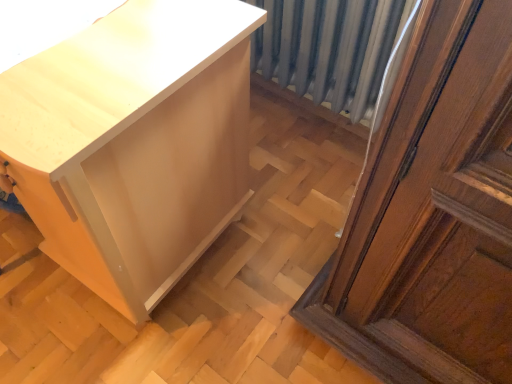
Where is `white glossy cabinet at lower left`? white glossy cabinet at lower left is located at coordinates (134, 143).

What is the approximate width of white glossy cabinet at lower left?

white glossy cabinet at lower left is 23.91 inches wide.

Describe the element at coordinates (134, 143) in the screenshot. I see `white glossy cabinet at lower left` at that location.

Where is `metallic gray radiator at center`? This screenshot has width=512, height=384. metallic gray radiator at center is located at coordinates (329, 49).

Describe the element at coordinates (329, 49) in the screenshot. I see `metallic gray radiator at center` at that location.

Where is `white glossy cabinet at lower left`? The image size is (512, 384). white glossy cabinet at lower left is located at coordinates (134, 143).

Between white glossy cabinet at lower left and metallic gray radiator at center, which one appears on the right side from the viewer's perspective?

From the viewer's perspective, metallic gray radiator at center appears more on the right side.

Is the depth of white glossy cabinet at lower left greater than that of metallic gray radiator at center?

No, white glossy cabinet at lower left is closer to the viewer.

Between point (187, 219) and point (303, 88), which one is positioned in front?

The point (187, 219) is in front.

From the image's perspective, does white glossy cabinet at lower left appear lower than metallic gray radiator at center?

Correct, white glossy cabinet at lower left appears lower than metallic gray radiator at center in the image.

From a real-world perspective, is white glossy cabinet at lower left below metallic gray radiator at center?

Correct, in the physical world, white glossy cabinet at lower left is lower than metallic gray radiator at center.

Can you confirm if white glossy cabinet at lower left is thinner than metallic gray radiator at center?

No.

Can you confirm if white glossy cabinet at lower left is taller than metallic gray radiator at center?

Yes.

Is white glossy cabinet at lower left smaller than metallic gray radiator at center?

No, white glossy cabinet at lower left is not smaller than metallic gray radiator at center.

Can metallic gray radiator at center be found inside white glossy cabinet at lower left?

No, metallic gray radiator at center is not inside white glossy cabinet at lower left.

Are white glossy cabinet at lower left and metallic gray radiator at center located far from each other?

No, white glossy cabinet at lower left is not far from metallic gray radiator at center.

Does white glossy cabinet at lower left turn towards metallic gray radiator at center?

No, white glossy cabinet at lower left is not aimed at metallic gray radiator at center.

In order to click on furniture below the metallic gray radiator at center (from the image's perspective) in this screenshot , I will do `click(134, 143)`.

Between metallic gray radiator at center and white glossy cabinet at lower left, which one appears on the left side from the viewer's perspective?

white glossy cabinet at lower left is more to the left.

From the picture: Relative to white glossy cabinet at lower left, is metallic gray radiator at center in front or behind?

Clearly, metallic gray radiator at center is behind white glossy cabinet at lower left.

Considering the positions of point (335, 16) and point (234, 73), is point (335, 16) closer or farther from the camera than point (234, 73)?

Point (335, 16) is farther from the camera than point (234, 73).

From the image's perspective, is metallic gray radiator at center on top of white glossy cabinet at lower left?

Yes, from the image's perspective, metallic gray radiator at center is over white glossy cabinet at lower left.

From a real-world perspective, is metallic gray radiator at center above or below white glossy cabinet at lower left?

metallic gray radiator at center is above white glossy cabinet at lower left.

Can you confirm if metallic gray radiator at center is wider than white glossy cabinet at lower left?

In fact, metallic gray radiator at center might be narrower than white glossy cabinet at lower left.

Does metallic gray radiator at center have a greater height compared to white glossy cabinet at lower left?

No.

Does metallic gray radiator at center have a larger size compared to white glossy cabinet at lower left?

Incorrect, metallic gray radiator at center is not larger than white glossy cabinet at lower left.

Would you say metallic gray radiator at center contains white glossy cabinet at lower left?

No, white glossy cabinet at lower left is not a part of metallic gray radiator at center.

Is metallic gray radiator at center directly adjacent to white glossy cabinet at lower left?

They are not placed beside each other.

Is metallic gray radiator at center facing away from white glossy cabinet at lower left?

No, metallic gray radiator at center is not facing the opposite direction of white glossy cabinet at lower left.

Can you tell me how much metallic gray radiator at center and white glossy cabinet at lower left differ in facing direction?

metallic gray radiator at center and white glossy cabinet at lower left are facing 2.86 degrees away from each other.

Measure the distance between metallic gray radiator at center and white glossy cabinet at lower left.

A distance of 29.66 inches exists between metallic gray radiator at center and white glossy cabinet at lower left.

Image resolution: width=512 pixels, height=384 pixels. In order to click on radiator on the right of white glossy cabinet at lower left in this screenshot , I will do `click(329, 49)`.

Where is `radiator above the white glossy cabinet at lower left (from the image's perspective)`? radiator above the white glossy cabinet at lower left (from the image's perspective) is located at coordinates (329, 49).

There is a white glossy cabinet at lower left. Identify the location of radiator above it (from a real-world perspective). The height and width of the screenshot is (384, 512). (329, 49).